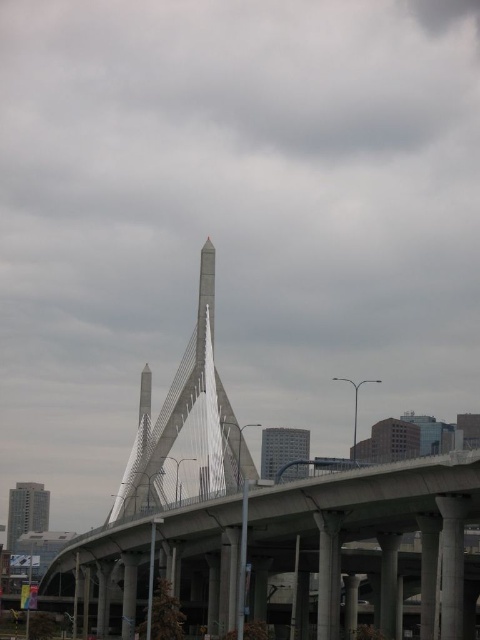
You are a city planner assessing the bridge structures in the image. The white metallic pedestrian bridge at center and the concrete bridge at center are both in the same location. Which bridge would require a taller support structure to accommodate its design?

The white metallic pedestrian bridge at center requires a taller support structure because it is much taller than the concrete bridge at center.

You are standing at the base of the bridge and want to take a photo of the white metallic pedestrian bridge at center. If your camera has a maximum zoom range of 200 feet, will you be able to capture the entire bridge without moving closer?

The white metallic pedestrian bridge at center is 263.96 feet away from the camera. Since the camera can only zoom up to 200 feet, you will not be able to capture the entire bridge without moving closer.

You are standing at the point with coordinates (269, 520). Looking around, you see the white metallic pedestrian bridge at center. Can you confirm if you are standing on the bridge?

The white metallic pedestrian bridge at center is located at point (269, 520), so yes, you are standing on the bridge.